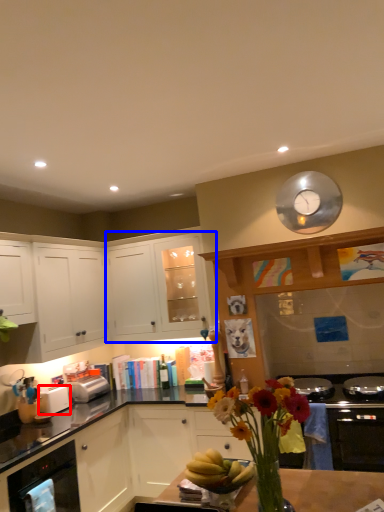
Question: Which of the following is the farthest to the observer, toaster (highlighted by a red box) or cabinetry (highlighted by a blue box)?

Choices:
 (A) toaster
 (B) cabinetry

Answer: (B)